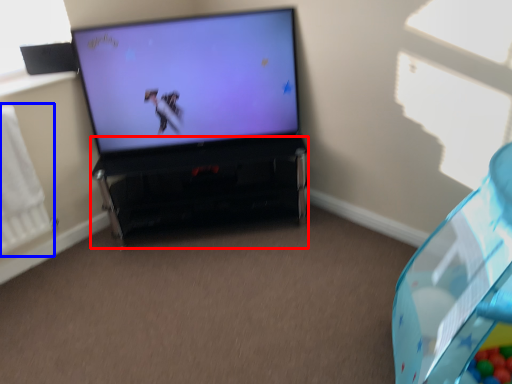
Question: Which object is further to the camera taking this photo, furniture (highlighted by a red box) or radiator (highlighted by a blue box)?

Choices:
 (A) furniture
 (B) radiator

Answer: (A)